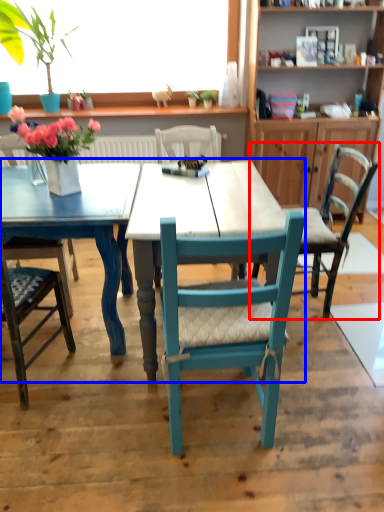
Question: Which point is closer to the camera, chair (highlighted by a red box) or kitchen & dining room table (highlighted by a blue box)?

Choices:
 (A) chair
 (B) kitchen & dining room table

Answer: (B)